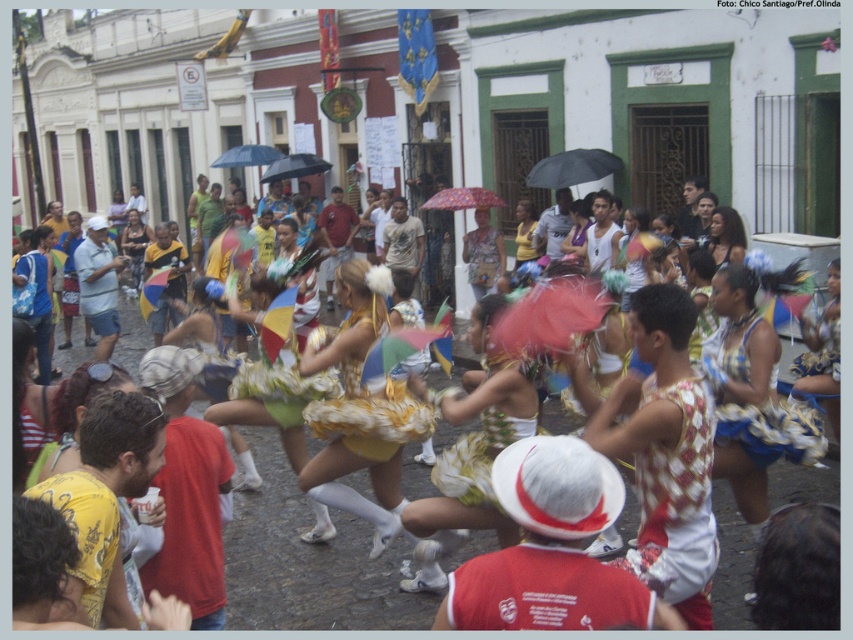
You are a photographer trying to capture both the gold sequined dress at center and the black matte umbrella at upper center in a single frame. Given their sizes, which object should you focus on to ensure both fit in the photo without cropping?

The gold sequined dress at center is larger in size than the black matte umbrella at upper center, so you should focus on the gold sequined dress at center to ensure both fit in the photo without cropping.

You are a photographer standing on the cobblestone street and want to capture a photo of the gold sequined dress at center and the black matte umbrella at upper center. Which object is positioned lower in the image?

The gold sequined dress at center is located below the black matte umbrella at upper center, so the gold sequined dress at center is positioned lower in the image.